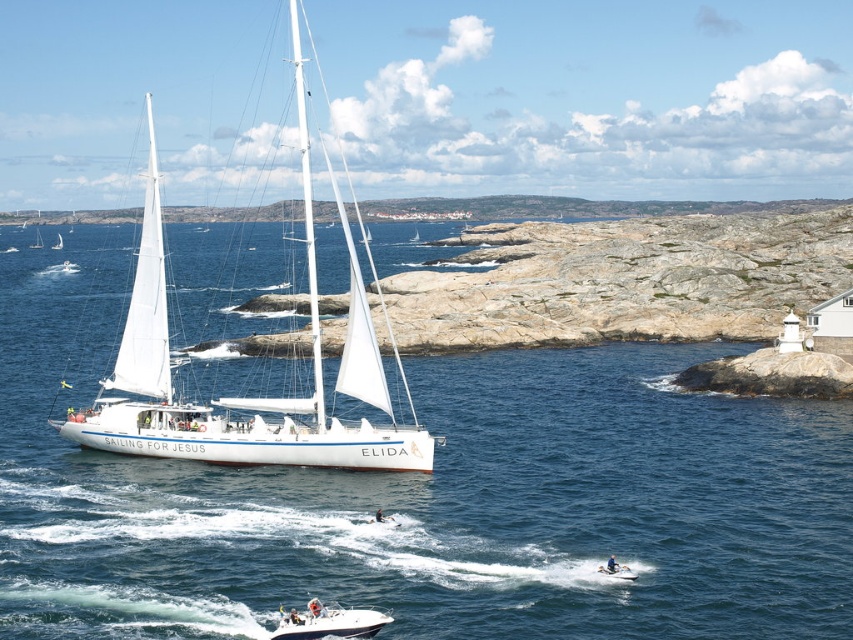
Question: Which point is farther to the camera?

Choices:
 (A) (36, 237)
 (B) (622, 572)

Answer: (A)

Question: Can you confirm if white water at center is positioned above white sailboat at center?

Choices:
 (A) yes
 (B) no

Answer: (B)

Question: Estimate the real-world distances between objects in this image. Which object is farther from the white glossy motorboat at lower center?

Choices:
 (A) white sailboat at center
 (B) white water at center
 (C) white matte boat at lower center
 (D) white matte sailboat at left

Answer: (A)

Question: Which point is farther to the camera?

Choices:
 (A) (289, 29)
 (B) (604, 573)

Answer: (A)

Question: Can you confirm if white matte sailboat at left is positioned to the left of white matte sailboat at upper left?

Choices:
 (A) no
 (B) yes

Answer: (A)

Question: Does white matte boat at lower center appear on the left side of white matte sailboat at upper left?

Choices:
 (A) yes
 (B) no

Answer: (B)